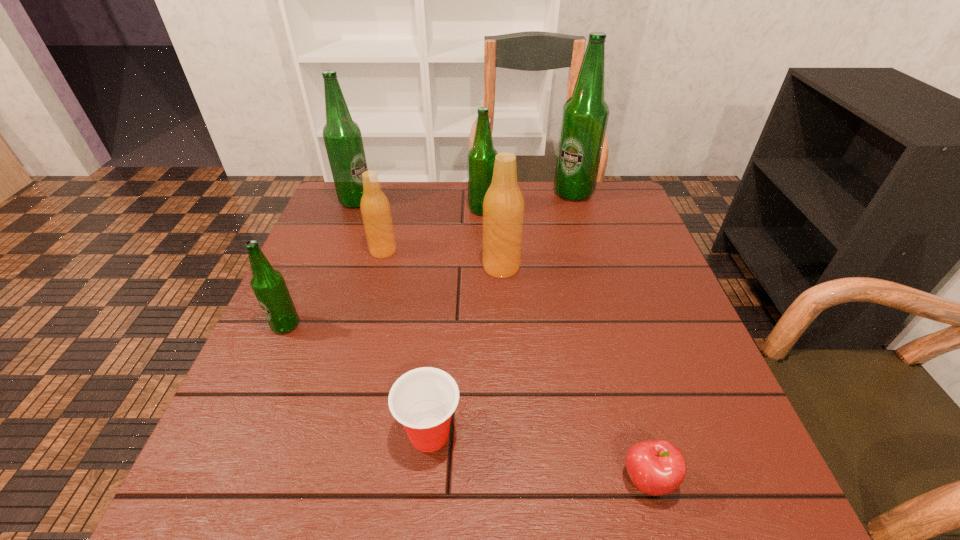
You are a GUI agent. You are given a task and a screenshot of the screen. Output one action in this format:
    pyautogui.click(x=<x>, y=<y>)
    Task: Click on the vacant area that lies between the tallest object and the smallest green beer bottle
    
    Given the screenshot: What is the action you would take?
    pyautogui.click(x=429, y=259)

Locate which object ranks fifth in proximity to the bigger tan beer bottle. Please provide its 2D coordinates. Your answer should be formatted as a tuple, i.e. [(x, y)], where the tuple contains the x and y coordinates of a point satisfying the conditions above.

[(342, 136)]

Locate which object ranks sixth in proximity to the red apple. Please provide its 2D coordinates. Your answer should be formatted as a tuple, i.e. [(x, y)], where the tuple contains the x and y coordinates of a point satisfying the conditions above.

[(585, 115)]

Identify which beer bottle is the fourth closest to the seventh tallest object. Please provide its 2D coordinates. Your answer should be formatted as a tuple, i.e. [(x, y)], where the tuple contains the x and y coordinates of a point satisfying the conditions above.

[(481, 157)]

Find the location of a particular element. The width and height of the screenshot is (960, 540). the second closest beer bottle to the third beer bottle from left to right is located at coordinates 481,157.

Identify which green beer bottle is the third nearest to the third green beer bottle from left to right. Please provide its 2D coordinates. Your answer should be formatted as a tuple, i.e. [(x, y)], where the tuple contains the x and y coordinates of a point satisfying the conditions above.

[(269, 287)]

At what (x,y) coordinates should I click in order to perform the action: click on green beer bottle that stands as the closest to the second smallest green beer bottle. Please return your answer as a coordinate pair (x, y). This screenshot has height=540, width=960. Looking at the image, I should click on (585, 115).

At what (x,y) coordinates should I click in order to perform the action: click on free space that satisfies the following two spatial constraints: 1. on the label of the rightmost green beer bottle; 2. on the label of the second biggest green beer bottle. Please return your answer as a coordinate pair (x, y). Image resolution: width=960 pixels, height=540 pixels. Looking at the image, I should click on (575, 201).

Where is `vacant region that satisfies the following two spatial constraints: 1. on the label of the second shortest object; 2. on the left side of the third nearest object`? Image resolution: width=960 pixels, height=540 pixels. vacant region that satisfies the following two spatial constraints: 1. on the label of the second shortest object; 2. on the left side of the third nearest object is located at coordinates (238, 434).

Locate an element on the screen. This screenshot has height=540, width=960. vacant space that satisfies the following two spatial constraints: 1. on the back side of the bigger tan beer bottle; 2. on the label of the second smallest green beer bottle is located at coordinates (498, 210).